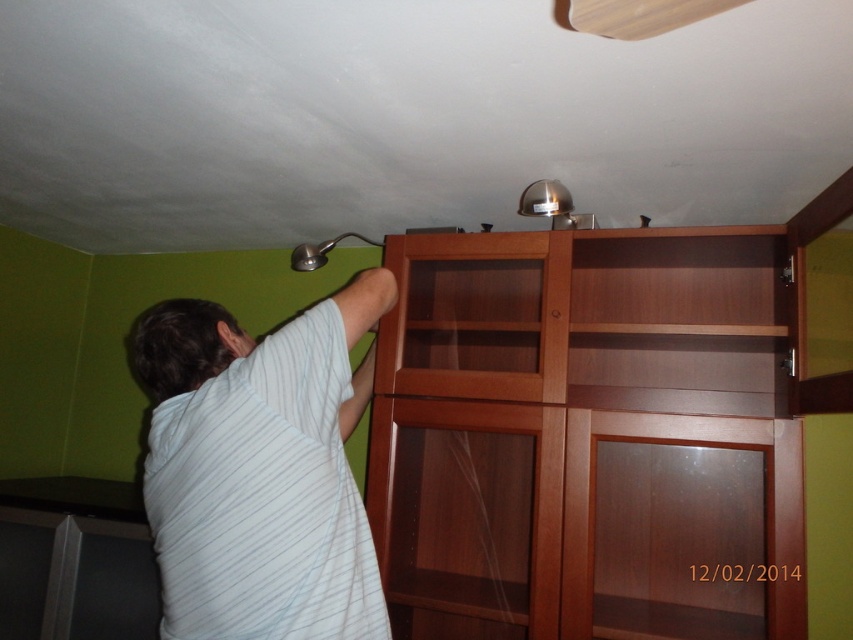
Is wooden cabinet at right thinner than white striped shirt at upper left?

No, wooden cabinet at right is not thinner than white striped shirt at upper left.

Who is more forward, (592, 576) or (312, 528)?

Point (312, 528) is in front.

In order to click on wooden cabinet at right in this screenshot , I will do `click(585, 438)`.

Find the location of a particular element. This screenshot has height=640, width=853. wooden cabinet at right is located at coordinates (585, 438).